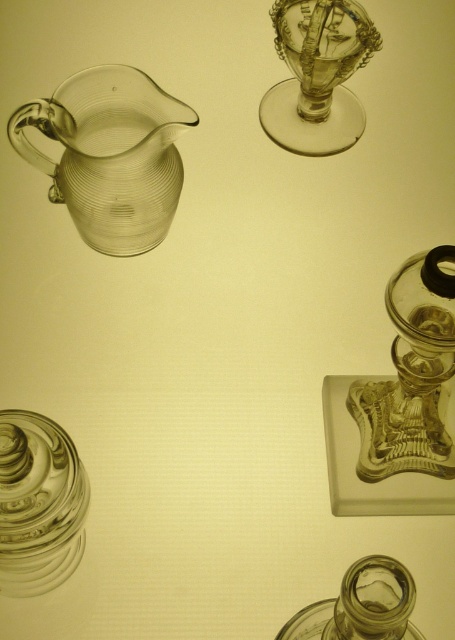
You are arranging items on a shelf and need to place the clear glass jar at lower left and the transparent glass wine glass at upper center. Based on their positions in the image, which item is closer to the bottom edge of the shelf?

The clear glass jar at lower left is closer to the bottom edge of the shelf because it is positioned under the transparent glass wine glass at upper center.

You are holding a camera and want to take a closeup photo of the transparent glass jug at upper left. The camera can focus on objects within 16 inches. Can you take the photo without moving the camera or the jug?

The transparent glass jug at upper left and camera are 15.42 inches apart from each other, which is within the camera focus range of 16 inches. Therefore, you can take the photo without moving the camera or the jug.